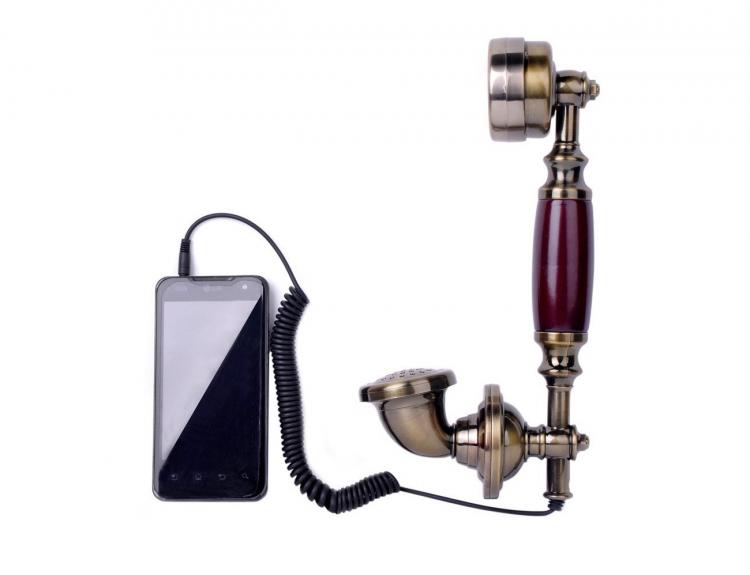
Where is `wood handle`? This screenshot has width=750, height=575. wood handle is located at coordinates (564, 260).